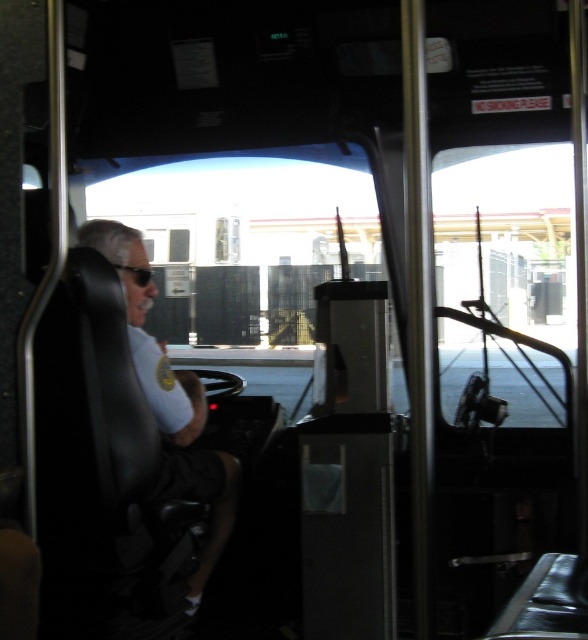
Question: Considering the relative positions of matte black shirt at left and black rubber goggles at upper left in the image provided, where is matte black shirt at left located with respect to black rubber goggles at upper left?

Choices:
 (A) right
 (B) left

Answer: (A)

Question: Among these objects, which one is farthest from the camera?

Choices:
 (A) matte black shirt at left
 (B) black rubber goggles at upper left

Answer: (B)

Question: Does matte black shirt at left appear on the right side of black rubber goggles at upper left?

Choices:
 (A) yes
 (B) no

Answer: (A)

Question: Is matte black shirt at left bigger than black rubber goggles at upper left?

Choices:
 (A) yes
 (B) no

Answer: (A)